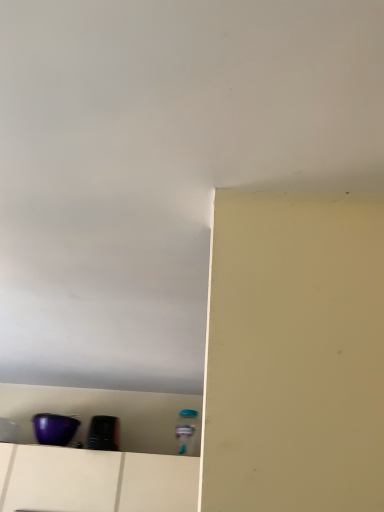
The width and height of the screenshot is (384, 512). Describe the element at coordinates (103, 433) in the screenshot. I see `black glossy toaster at lower left, the 2th appliance in the left-to-right sequence` at that location.

Describe the element at coordinates (54, 429) in the screenshot. This screenshot has height=512, width=384. I see `purple glossy bowl at lower left, the 2th appliance from the right` at that location.

The image size is (384, 512). What do you see at coordinates (98, 454) in the screenshot?
I see `purple plastic container at lower left` at bounding box center [98, 454].

Where is `white matte drawer at lower left`? The height and width of the screenshot is (512, 384). white matte drawer at lower left is located at coordinates (62, 480).

Is white matte drawer at lower left to the left of purple plastic container at lower left from the viewer's perspective?

No.

Which of these two, white matte drawer at lower left or purple plastic container at lower left, is wider?

purple plastic container at lower left is wider.

Which is nearer, (x=76, y=482) or (x=27, y=448)?

Point (x=76, y=482) is closer to the camera than point (x=27, y=448).

Does purple glossy bowl at lower left, the 1th appliance viewed from the left, have a greater height compared to white matte drawer at lower left?

Incorrect, the height of purple glossy bowl at lower left, the 1th appliance viewed from the left, is not larger of that of white matte drawer at lower left.

Is purple glossy bowl at lower left, the 2th appliance from the right, not inside white matte drawer at lower left?

Yes, purple glossy bowl at lower left, the 2th appliance from the right, is outside of white matte drawer at lower left.

Is purple glossy bowl at lower left, the 2th appliance from the right, to the left of white matte drawer at lower left from the viewer's perspective?

Indeed, purple glossy bowl at lower left, the 2th appliance from the right, is positioned on the left side of white matte drawer at lower left.

From the image's perspective, is purple glossy bowl at lower left, the 2th appliance from the right, beneath white matte drawer at lower left?

No.

Does purple glossy bowl at lower left, the 1th appliance viewed from the left, appear on the right side of purple plastic container at lower left?

Incorrect, purple glossy bowl at lower left, the 1th appliance viewed from the left, is not on the right side of purple plastic container at lower left.

Is purple glossy bowl at lower left, the 2th appliance from the right, positioned behind purple plastic container at lower left?

Yes, it is behind purple plastic container at lower left.

Is purple glossy bowl at lower left, the 2th appliance from the right, positioned with its back to purple plastic container at lower left?

purple glossy bowl at lower left, the 2th appliance from the right, is not turned away from purple plastic container at lower left.

Is point (73, 430) closer to viewer compared to point (39, 466)?

No, it is not.

Does black glossy toaster at lower left, positioned as the first appliance in right-to-left order, have a smaller size compared to purple plastic container at lower left?

Yes, black glossy toaster at lower left, positioned as the first appliance in right-to-left order, is smaller than purple plastic container at lower left.

From a real-world perspective, is black glossy toaster at lower left, the 2th appliance in the left-to-right sequence, above or below purple plastic container at lower left?

Clearly, from a real-world perspective, black glossy toaster at lower left, the 2th appliance in the left-to-right sequence, is above purple plastic container at lower left.

Between point (114, 438) and point (86, 411), which one is positioned in front?

The point (114, 438) is more forward.

Does black glossy toaster at lower left, positioned as the first appliance in right-to-left order, appear on the right side of purple plastic container at lower left?

Yes, black glossy toaster at lower left, positioned as the first appliance in right-to-left order, is to the right of purple plastic container at lower left.

In terms of height, does white matte drawer at lower left look taller or shorter compared to black glossy toaster at lower left, the 2th appliance in the left-to-right sequence?

white matte drawer at lower left is taller than black glossy toaster at lower left, the 2th appliance in the left-to-right sequence.

How different are the orientations of white matte drawer at lower left and black glossy toaster at lower left, positioned as the first appliance in right-to-left order, in degrees?

They differ by 0.934 degrees in their facing directions.

Would you say white matte drawer at lower left is a long distance from black glossy toaster at lower left, positioned as the first appliance in right-to-left order?

white matte drawer at lower left is near black glossy toaster at lower left, positioned as the first appliance in right-to-left order, not far away.

From a real-world perspective, is white matte drawer at lower left positioned over black glossy toaster at lower left, the 2th appliance in the left-to-right sequence, based on gravity?

No, from a real-world perspective, white matte drawer at lower left is not above black glossy toaster at lower left, the 2th appliance in the left-to-right sequence.

Is white matte drawer at lower left at the back of purple plastic container at lower left?

That's right, purple plastic container at lower left is facing away from white matte drawer at lower left.

Does purple plastic container at lower left have a smaller size compared to white matte drawer at lower left?

Incorrect, purple plastic container at lower left is not smaller in size than white matte drawer at lower left.

From the image's perspective, is purple plastic container at lower left located above or below white matte drawer at lower left?

purple plastic container at lower left is above white matte drawer at lower left.

From a real-world perspective, is purple plastic container at lower left beneath black glossy toaster at lower left, positioned as the first appliance in right-to-left order?

Correct, in the physical world, purple plastic container at lower left is lower than black glossy toaster at lower left, positioned as the first appliance in right-to-left order.

Is purple plastic container at lower left facing away from black glossy toaster at lower left, the 2th appliance in the left-to-right sequence?

No, purple plastic container at lower left is not facing the opposite direction of black glossy toaster at lower left, the 2th appliance in the left-to-right sequence.

Would you say purple plastic container at lower left is outside black glossy toaster at lower left, the 2th appliance in the left-to-right sequence?

That's correct, purple plastic container at lower left is outside of black glossy toaster at lower left, the 2th appliance in the left-to-right sequence.

Does point (83, 391) lie in front of point (93, 437)?

No, (83, 391) is behind (93, 437).

You are a GUI agent. You are given a task and a screenshot of the screen. Output one action in this format:
    pyautogui.click(x=<x>, y=<y>)
    Task: Click on the shelf positioned vertically above the white matte drawer at lower left (from a real-world perspective)
    Image resolution: width=384 pixels, height=512 pixels.
    Given the screenshot: What is the action you would take?
    pyautogui.click(x=98, y=454)

This screenshot has height=512, width=384. Find the location of `drawer on the right of purple glossy bowl at lower left, the 2th appliance from the right`. drawer on the right of purple glossy bowl at lower left, the 2th appliance from the right is located at coordinates (62, 480).

From the image, which object appears to be farther from purple glossy bowl at lower left, the 2th appliance from the right, white matte drawer at lower left or black glossy toaster at lower left, positioned as the first appliance in right-to-left order?

white matte drawer at lower left lies further to purple glossy bowl at lower left, the 2th appliance from the right, than the other object.

Based on their spatial positions, is black glossy toaster at lower left, the 2th appliance in the left-to-right sequence, or purple glossy bowl at lower left, the 2th appliance from the right, closer to white matte drawer at lower left?

purple glossy bowl at lower left, the 2th appliance from the right, is closer to white matte drawer at lower left.

Which object lies further to the anchor point white matte drawer at lower left, black glossy toaster at lower left, the 2th appliance in the left-to-right sequence, or purple plastic container at lower left?

black glossy toaster at lower left, the 2th appliance in the left-to-right sequence, lies further to white matte drawer at lower left than the other object.

Which object lies nearer to the anchor point purple glossy bowl at lower left, the 2th appliance from the right, white matte drawer at lower left or purple plastic container at lower left?

The object closer to purple glossy bowl at lower left, the 2th appliance from the right, is white matte drawer at lower left.

Looking at the image, which one is located closer to black glossy toaster at lower left, positioned as the first appliance in right-to-left order, white matte drawer at lower left or purple plastic container at lower left?

purple plastic container at lower left.

Based on their spatial positions, is purple glossy bowl at lower left, the 1th appliance viewed from the left, or white matte drawer at lower left closer to purple plastic container at lower left?

white matte drawer at lower left.

From the image, which object appears to be nearer to black glossy toaster at lower left, positioned as the first appliance in right-to-left order, purple plastic container at lower left or white matte drawer at lower left?

Based on the image, purple plastic container at lower left appears to be nearer to black glossy toaster at lower left, positioned as the first appliance in right-to-left order.

When comparing their distances from purple glossy bowl at lower left, the 1th appliance viewed from the left, does black glossy toaster at lower left, positioned as the first appliance in right-to-left order, or purple plastic container at lower left seem closer?

Based on the image, black glossy toaster at lower left, positioned as the first appliance in right-to-left order, appears to be nearer to purple glossy bowl at lower left, the 1th appliance viewed from the left.

At what (x,y) coordinates should I click in order to perform the action: click on drawer between purple glossy bowl at lower left, the 2th appliance from the right, and black glossy toaster at lower left, positioned as the first appliance in right-to-left order. Please return your answer as a coordinate pair (x, y). This screenshot has height=512, width=384. Looking at the image, I should click on (62, 480).

Find the location of a particular element. The height and width of the screenshot is (512, 384). appliance between purple plastic container at lower left and purple glossy bowl at lower left, the 2th appliance from the right, in the front-back direction is located at coordinates (103, 433).

Locate an element on the screen. drawer positioned between purple plastic container at lower left and purple glossy bowl at lower left, the 1th appliance viewed from the left, from near to far is located at coordinates (62, 480).

In order to click on drawer located between purple plastic container at lower left and black glossy toaster at lower left, positioned as the first appliance in right-to-left order, in the depth direction in this screenshot , I will do `click(62, 480)`.